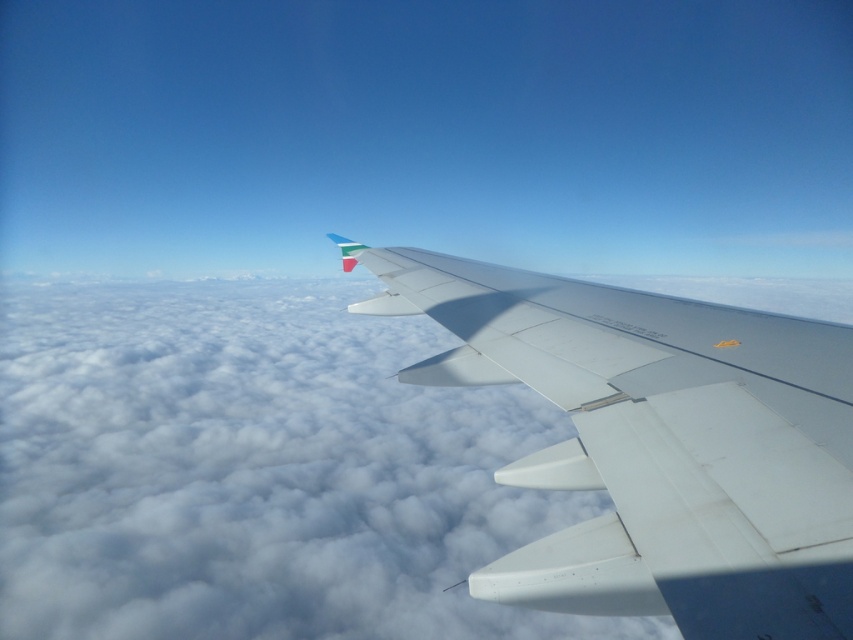
Which is more to the left, white fluffy cloud at upper center or white matte wing at upper right?

Positioned to the left is white fluffy cloud at upper center.

From the picture: Between white fluffy cloud at upper center and white matte wing at upper right, which one is positioned lower?

Positioned lower is white fluffy cloud at upper center.

The image size is (853, 640). Find the location of `white fluffy cloud at upper center`. white fluffy cloud at upper center is located at coordinates (257, 468).